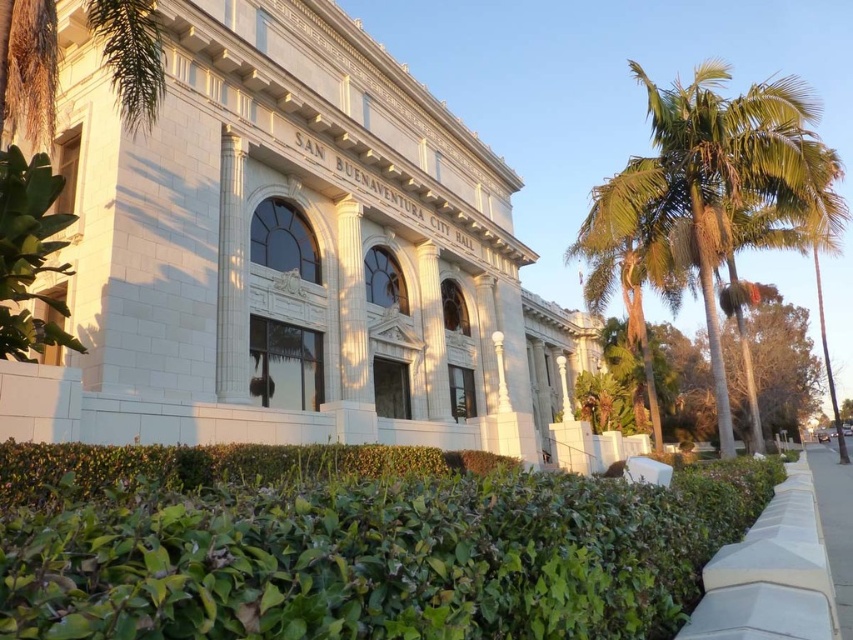
Question: Considering the real-world distances, which object is closest to the green leafy palm tree at right?

Choices:
 (A) white concrete pavement at lower right
 (B) green leafy tree at right
 (C) green leafy hedge at lower center

Answer: (A)

Question: Can you confirm if green leafy palm tree at right is positioned to the left of white concrete pavement at lower right?

Choices:
 (A) yes
 (B) no

Answer: (A)

Question: Which object is positioned closest to the green leafy hedge at lower center?

Choices:
 (A) green leafy palm tree at right
 (B) green leafy tree at right

Answer: (A)

Question: Does green leafy palm tree at right appear on the left side of green leafy tree at right?

Choices:
 (A) yes
 (B) no

Answer: (A)

Question: Which point is farther from the camera taking this photo?

Choices:
 (A) (608, 502)
 (B) (624, 381)
 (C) (827, 458)

Answer: (C)

Question: Can you confirm if green leafy tree at right is positioned above white concrete pavement at lower right?

Choices:
 (A) yes
 (B) no

Answer: (A)